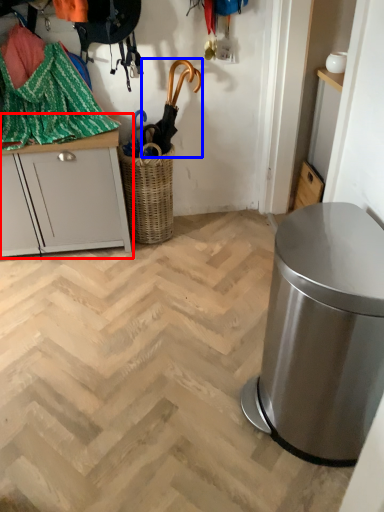
Question: Which point is closer to the camera, cabinetry (highlighted by a red box) or umbrella (highlighted by a blue box)?

Choices:
 (A) cabinetry
 (B) umbrella

Answer: (A)